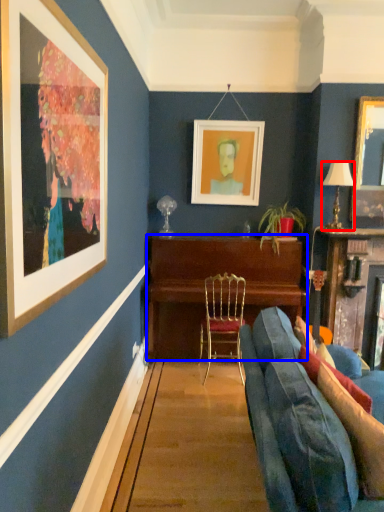
Question: Which object appears farthest to the camera in this image, lamp (highlighted by a red box) or desk (highlighted by a blue box)?

Choices:
 (A) lamp
 (B) desk

Answer: (B)